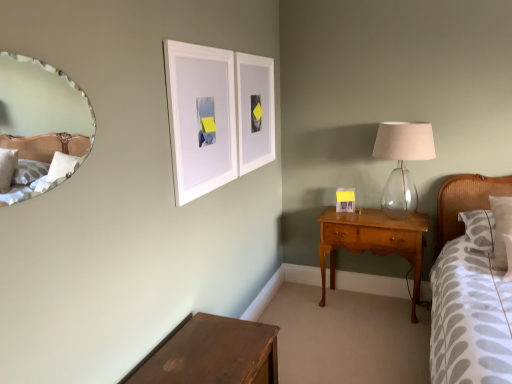
Question: Do you think white matte picture frame at upper center, which is the 3th picture frame from right to left, is within matte white picture frame at right, the 3th picture frame from the left, or outside of it?

Choices:
 (A) inside
 (B) outside

Answer: (B)

Question: Is white matte picture frame at upper center, acting as the 3th picture frame starting from the back, bigger or smaller than matte white picture frame at right, which is the 1th picture frame in back-to-front order?

Choices:
 (A) small
 (B) big

Answer: (B)

Question: Estimate the real-world distances between objects in this image. Which object is closer to the white textured pillow at right?

Choices:
 (A) dark brown wooden table at lower left
 (B) white matte picture frame at upper center, acting as the first picture frame starting from the left
 (C) clear glass lampshade at right
 (D) light brown wood nightstand at center right
 (E) matte white picture frame at right, the 3th picture frame from the left

Answer: (D)

Question: Which object is the closest to the white matte picture frame at upper center, acting as the first picture frame starting from the left?

Choices:
 (A) matte white picture frame at right, marked as the first picture frame in a right-to-left arrangement
 (B) clear glass lampshade at right
 (C) dark brown wooden table at lower left
 (D) white matte picture frame at upper center, the second picture frame viewed from the front
 (E) white textured pillow at right

Answer: (D)